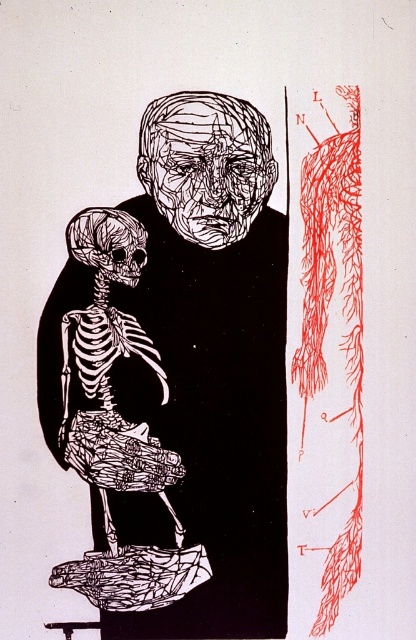
Question: Which point is farther from the camera taking this photo?

Choices:
 (A) (93, 362)
 (B) (173, 260)

Answer: (B)

Question: Which point appears farthest from the camera in this image?

Choices:
 (A) (106, 324)
 (B) (232, 374)

Answer: (B)

Question: Can you confirm if white line art face at upper center is positioned to the right of white bone-like skeleton at left?

Choices:
 (A) no
 (B) yes

Answer: (B)

Question: Does white line art face at upper center appear on the left side of white bone-like skeleton at left?

Choices:
 (A) no
 (B) yes

Answer: (A)

Question: Considering the relative positions of white line art face at upper center and white bone-like skeleton at left in the image provided, where is white line art face at upper center located with respect to white bone-like skeleton at left?

Choices:
 (A) right
 (B) left

Answer: (A)